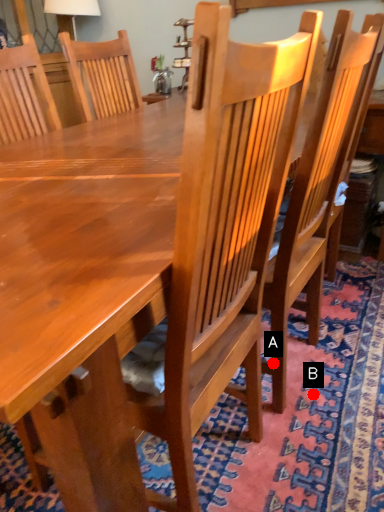
Question: Two points are circled on the image, labeled by A and B beside each circle. Which point is further to the camera?

Choices:
 (A) A is further
 (B) B is further

Answer: (B)